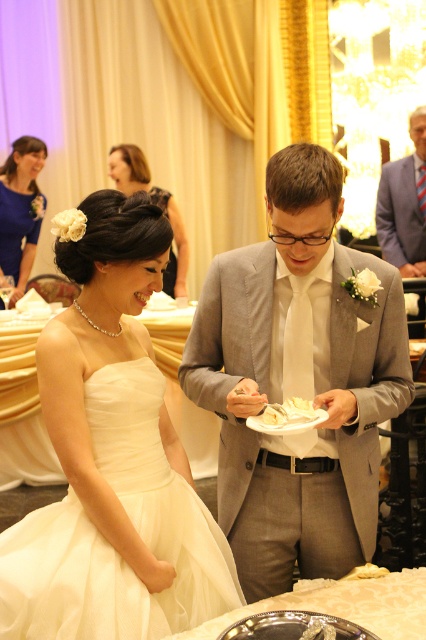
Question: Which object is positioned closest to the satin black dress at upper left?

Choices:
 (A) white satin dress at left
 (B) light blue textured suit at upper right
 (C) white paper napkin at center

Answer: (B)

Question: Is the position of white satin dress at left less distant than that of light blue textured suit at upper right?

Choices:
 (A) yes
 (B) no

Answer: (A)

Question: Among these points, which one is nearest to the camera?

Choices:
 (A) (28, 198)
 (B) (163, 285)
 (C) (229, 369)
 (D) (291, 417)

Answer: (D)

Question: Does light blue textured suit at upper right appear under white paper napkin at center?

Choices:
 (A) no
 (B) yes

Answer: (A)

Question: In this image, where is light blue textured suit at upper right located relative to white paper napkin at center?

Choices:
 (A) right
 (B) left

Answer: (A)

Question: Which point is closer to the camera?

Choices:
 (A) white satin dress at left
 (B) light blue textured suit at upper right
 (C) blue satin dress at upper left
 (D) satin black dress at upper left

Answer: (A)